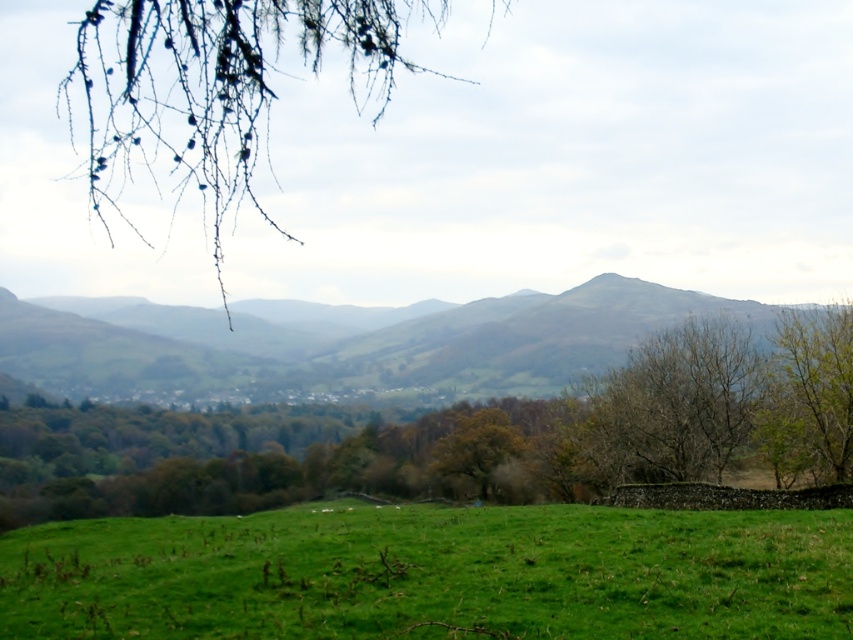
Is green leafy tree at center closer to camera compared to green grassy hill at center?

Yes, green leafy tree at center is closer to the viewer.

Does point (733, 394) lie behind point (112, 326)?

No, it is in front of (112, 326).

Locate an element on the screen. The width and height of the screenshot is (853, 640). green leafy tree at center is located at coordinates (440, 410).

Does point (556, 524) come behind point (183, 129)?

No, it is not.

Between green grassy field at lower center and green leafy branch at upper left, which one is positioned higher?

green leafy branch at upper left is above.

Which is in front, point (614, 547) or point (213, 60)?

Positioned in front is point (614, 547).

What are the coordinates of `green grassy field at lower center` in the screenshot? It's located at (433, 573).

From the picture: Does green grassy hill at center have a larger size compared to bare branches at center?

Answer: Yes.

Who is positioned more to the left, green grassy hill at center or bare branches at center?

Positioned to the left is green grassy hill at center.

Which is in front, point (274, 388) or point (718, 416)?

Positioned in front is point (718, 416).

This screenshot has height=640, width=853. Find the location of `green grassy hill at center`. green grassy hill at center is located at coordinates click(x=343, y=344).